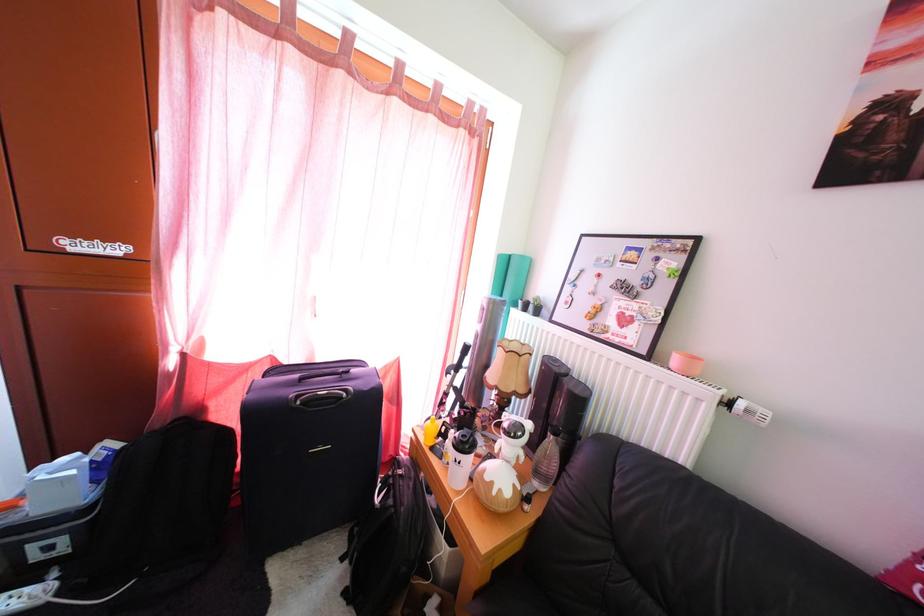
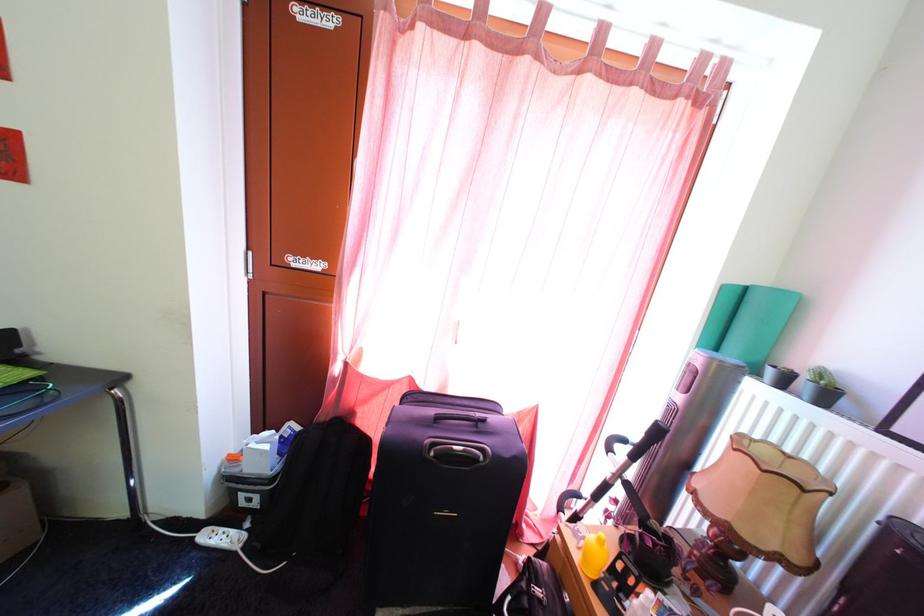
In the second image, find the point that corresponds to [529,363] in the first image.

(812, 499)